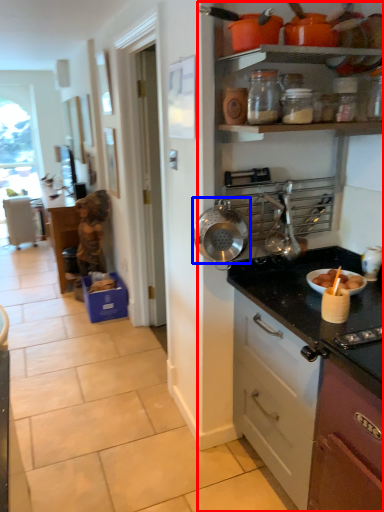
Question: Which point is further to the camera, dresser (highlighted by a red box) or kitchen appliance (highlighted by a blue box)?

Choices:
 (A) dresser
 (B) kitchen appliance

Answer: (B)